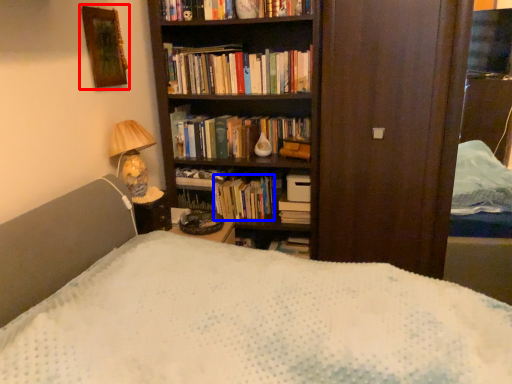
Question: Which object is further to the camera taking this photo, picture frame (highlighted by a red box) or book (highlighted by a blue box)?

Choices:
 (A) picture frame
 (B) book

Answer: (B)